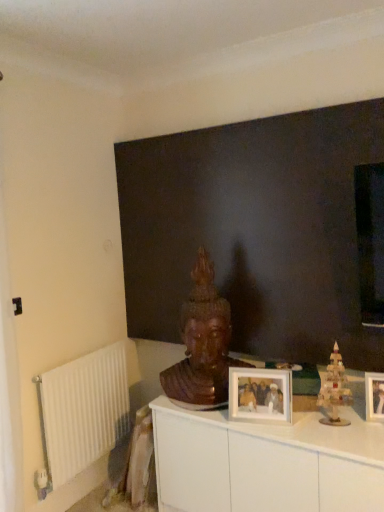
In order to click on blank space to the left of wooden christmas tree at right in this screenshot , I will do `click(304, 425)`.